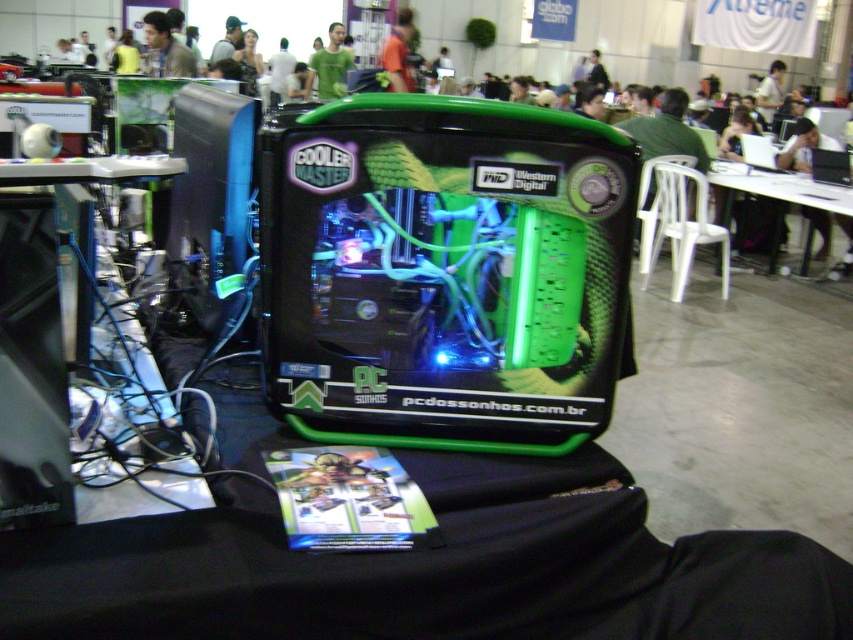
Question: Based on their relative distances, which object is nearer to the light brown leather jacket at upper center?

Choices:
 (A) white plastic table at lower right
 (B) green matte shirt at upper center
 (C) yellow-green shirt at upper center
 (D) green matte computer case at center

Answer: (B)

Question: Is yellow-green shirt at upper center bigger than dark green fabric jacket at upper center?

Choices:
 (A) yes
 (B) no

Answer: (A)

Question: Which object appears farthest from the camera in this image?

Choices:
 (A) orange fabric shirt at center
 (B) white plastic table at lower right
 (C) green matte computer case at center
 (D) light brown leather jacket at upper center

Answer: (A)

Question: Which is farther from the light brown leather jacket at upper center?

Choices:
 (A) white shirt at upper center
 (B) orange fabric shirt at center
 (C) dark green fabric jacket at upper center

Answer: (A)

Question: Does white plastic table at lower right appear on the left side of green matte shirt at upper center?

Choices:
 (A) yes
 (B) no

Answer: (B)

Question: Can you confirm if white shirt at upper center is positioned above dark green fabric jacket at upper center?

Choices:
 (A) no
 (B) yes

Answer: (A)